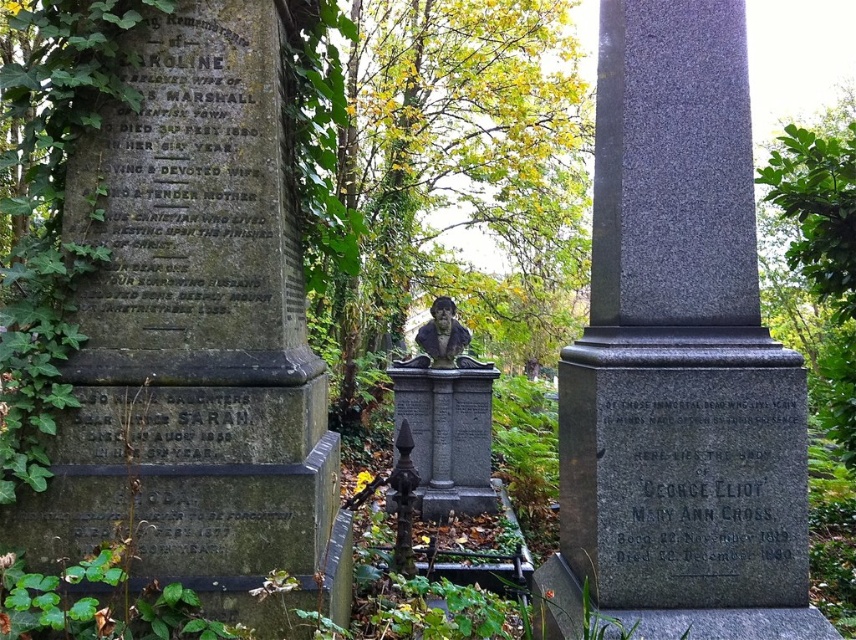
You are a groundskeeper in the cemetery and need to place a new flowerpot between the granite stone monument at left and the ornate marble headstone at center. The flowerpot is 1.5 meters wide. Will there be enough space between them to place the flowerpot without moving either monument?

The granite stone monument at left and the ornate marble headstone at center are 2.19 meters apart. Since the flowerpot is 1.5 meters wide, there is sufficient space between them to place the flowerpot without moving either monument.

You are a historian examining the cemetery layout. You notice the granite obelisk at center and the polished bronze bust at center. Which of these two monuments is bigger in size?

The granite obelisk at center is larger in size than the polished bronze bust at center.

You are a historian examining the cemetery layout. You need to determine the relative heights of the granite stone monument at left and the granite obelisk at center. Which one is taller?

The granite stone monument at left is taller than the granite obelisk at center.